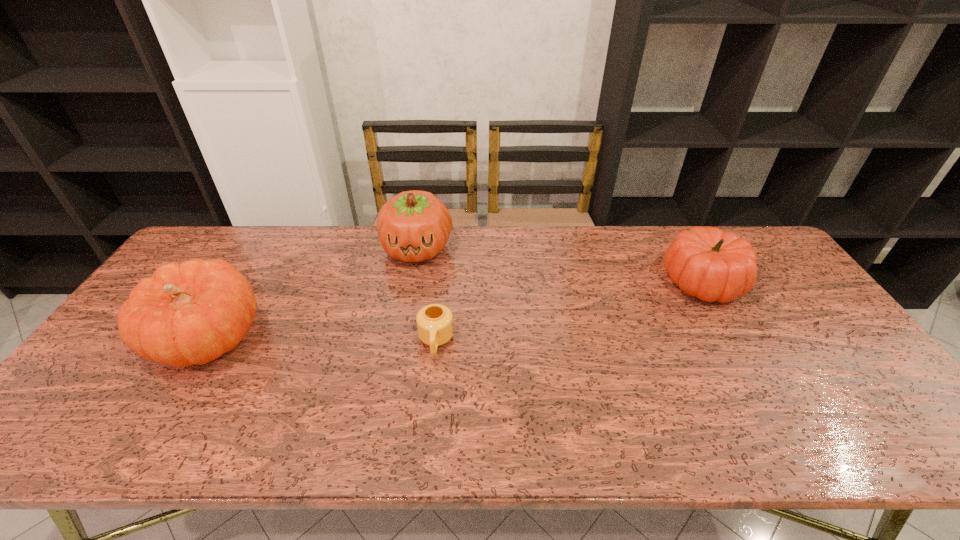
Locate an element on the screen. free space that satisfies the following two spatial constraints: 1. on the side of the rightmost object with the cute face; 2. on the left side of the second pumpkin from right to left is located at coordinates (411, 282).

At what (x,y) coordinates should I click in order to perform the action: click on vacant area in the image that satisfies the following two spatial constraints: 1. on the side of the second shortest object with the cute face; 2. on the left side of the second pumpkin from left to right. Please return your answer as a coordinate pair (x, y). Looking at the image, I should click on [x=411, y=282].

The width and height of the screenshot is (960, 540). Identify the location of vacant area that satisfies the following two spatial constraints: 1. on the side of the rightmost object with the cute face; 2. on the left side of the second pumpkin from left to right. (411, 282).

Locate an element on the screen. This screenshot has width=960, height=540. free space in the image that satisfies the following two spatial constraints: 1. on the back side of the leftmost pumpkin; 2. on the right side of the second shortest object is located at coordinates (242, 282).

The image size is (960, 540). In order to click on free space that satisfies the following two spatial constraints: 1. on the side of the rightmost object with the cute face; 2. on the right side of the second pumpkin from left to right in this screenshot , I will do `click(411, 282)`.